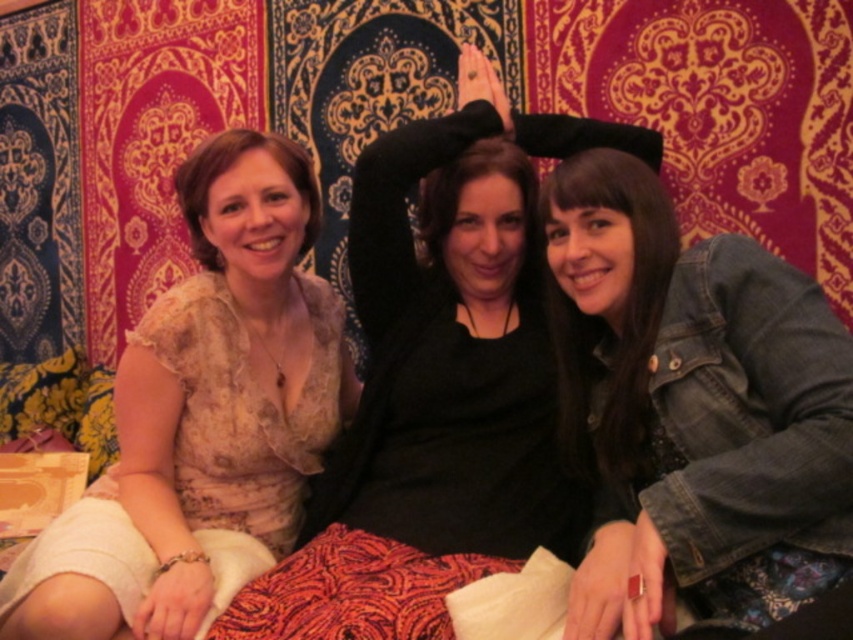
Question: Considering the relative positions of denim jacket at center and matte beige blouse at left in the image provided, where is denim jacket at center located with respect to matte beige blouse at left?

Choices:
 (A) right
 (B) left

Answer: (A)

Question: Is denim jacket at center wider than matte beige blouse at left?

Choices:
 (A) yes
 (B) no

Answer: (B)

Question: Is denim jacket at center wider than matte beige blouse at left?

Choices:
 (A) no
 (B) yes

Answer: (A)

Question: Which object appears closest to the camera in this image?

Choices:
 (A) denim jacket at center
 (B) matte beige blouse at left

Answer: (A)